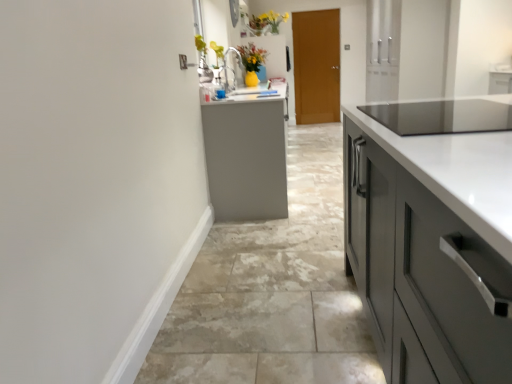
Question: Is yellow matte vase at upper center at the right side of brown wooden door at center?

Choices:
 (A) yes
 (B) no

Answer: (B)

Question: From the image's perspective, is yellow matte vase at upper center located above brown wooden door at center?

Choices:
 (A) yes
 (B) no

Answer: (A)

Question: From the image's perspective, is yellow matte vase at upper center located beneath brown wooden door at center?

Choices:
 (A) no
 (B) yes

Answer: (A)

Question: Does yellow matte vase at upper center have a greater width compared to brown wooden door at center?

Choices:
 (A) no
 (B) yes

Answer: (B)

Question: Is yellow matte vase at upper center far from brown wooden door at center?

Choices:
 (A) yes
 (B) no

Answer: (B)

Question: Is yellow matte vase at upper center in front of or behind gray tile floor at center in the image?

Choices:
 (A) front
 (B) behind

Answer: (B)

Question: From a real-world perspective, relative to gray tile floor at center, is yellow matte vase at upper center vertically above or below?

Choices:
 (A) below
 (B) above

Answer: (B)

Question: Considering the relative positions of yellow matte vase at upper center and gray tile floor at center in the image provided, is yellow matte vase at upper center to the left or to the right of gray tile floor at center?

Choices:
 (A) left
 (B) right

Answer: (A)

Question: From the image's perspective, is yellow matte vase at upper center above or below gray tile floor at center?

Choices:
 (A) above
 (B) below

Answer: (A)

Question: Considering the positions of brown wooden door at center and yellow matte vase at upper center in the image, is brown wooden door at center bigger or smaller than yellow matte vase at upper center?

Choices:
 (A) small
 (B) big

Answer: (B)

Question: From the image's perspective, is brown wooden door at center positioned above or below yellow matte vase at upper center?

Choices:
 (A) above
 (B) below

Answer: (B)

Question: Is point (323, 52) closer or farther from the camera than point (257, 34)?

Choices:
 (A) closer
 (B) farther

Answer: (B)

Question: Do you think brown wooden door at center is within yellow matte vase at upper center, or outside of it?

Choices:
 (A) inside
 (B) outside

Answer: (B)

Question: Looking at their shapes, would you say gray tile floor at center is wider or thinner than yellow matte vase at upper center?

Choices:
 (A) wide
 (B) thin

Answer: (A)

Question: Is gray tile floor at center taller or shorter than yellow matte vase at upper center?

Choices:
 (A) short
 (B) tall

Answer: (A)